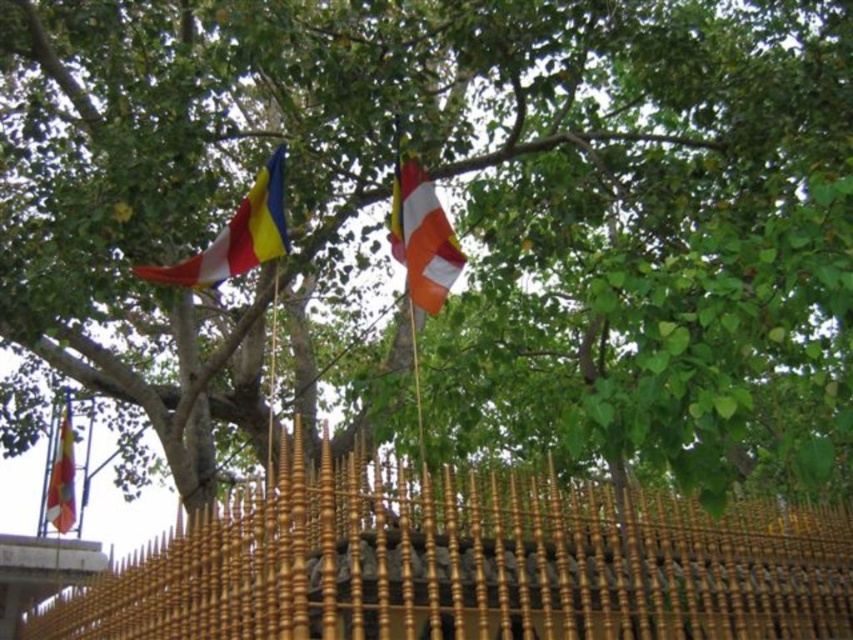
Does orange and white striped flag at center appear on the left side of matte yellow flag at lower left?

No, orange and white striped flag at center is not to the left of matte yellow flag at lower left.

Which is more to the left, orange and white striped flag at center or matte yellow flag at lower left?

matte yellow flag at lower left

This screenshot has height=640, width=853. Describe the element at coordinates (422, 236) in the screenshot. I see `orange and white striped flag at center` at that location.

Where is `orange and white striped flag at center`? The width and height of the screenshot is (853, 640). orange and white striped flag at center is located at coordinates (422, 236).

Does gold polished wood fence at lower center lie in front of matte yellow flag at lower left?

Yes, gold polished wood fence at lower center is closer to the viewer.

Between gold polished wood fence at lower center and matte yellow flag at lower left, which one has less height?

gold polished wood fence at lower center is shorter.

Image resolution: width=853 pixels, height=640 pixels. Describe the element at coordinates (466, 564) in the screenshot. I see `gold polished wood fence at lower center` at that location.

The width and height of the screenshot is (853, 640). In order to click on gold polished wood fence at lower center in this screenshot , I will do `click(466, 564)`.

Is point (625, 544) closer to camera compared to point (422, 180)?

Yes.

Does gold polished wood fence at lower center appear under orange and white striped flag at center?

Indeed, gold polished wood fence at lower center is positioned under orange and white striped flag at center.

This screenshot has width=853, height=640. I want to click on gold polished wood fence at lower center, so click(x=466, y=564).